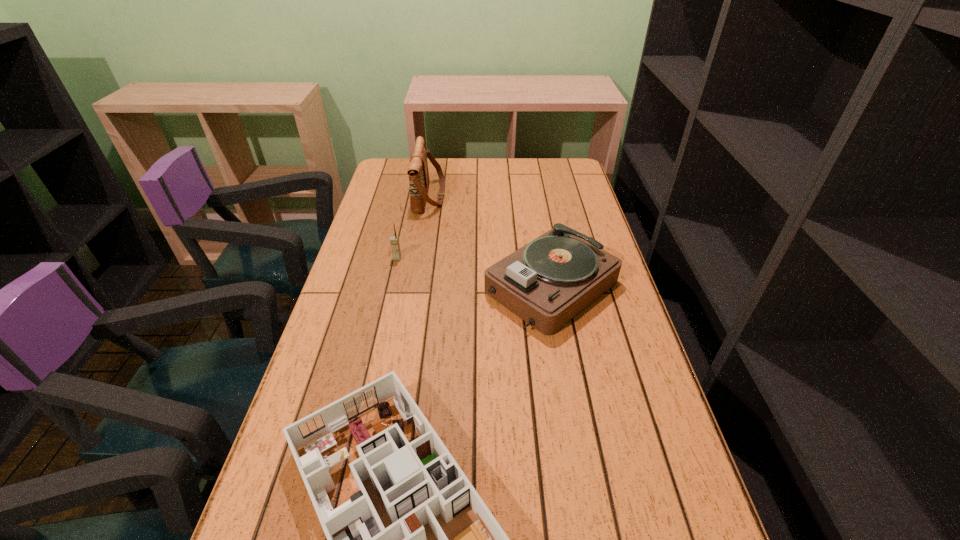
You are a GUI agent. You are given a task and a screenshot of the screen. Output one action in this format:
    pyautogui.click(x=<x>, y=<y>)
    Task: Click on the free location that satisfies the following two spatial constraints: 1. on the front-facing side of the record player; 2. on the left side of the tallest object
    This screenshot has width=960, height=540.
    Given the screenshot: What is the action you would take?
    pyautogui.click(x=415, y=287)

You are a GUI agent. You are given a task and a screenshot of the screen. Output one action in this format:
    pyautogui.click(x=<x>, y=<y>)
    Task: Click on the vacant space that satisfies the following two spatial constraints: 1. on the front of the cellular telephone, where the keypad is located; 2. on the left side of the record player
    
    Given the screenshot: What is the action you would take?
    pyautogui.click(x=391, y=287)

Where is `vacant space that satisfies the following two spatial constraints: 1. on the front of the cellular telephone, where the keypad is located; 2. on the right side of the record player`? vacant space that satisfies the following two spatial constraints: 1. on the front of the cellular telephone, where the keypad is located; 2. on the right side of the record player is located at coordinates (391, 287).

Locate an element on the screen. free space in the image that satisfies the following two spatial constraints: 1. on the front of the cellular telephone, where the keypad is located; 2. on the left side of the record player is located at coordinates (391, 287).